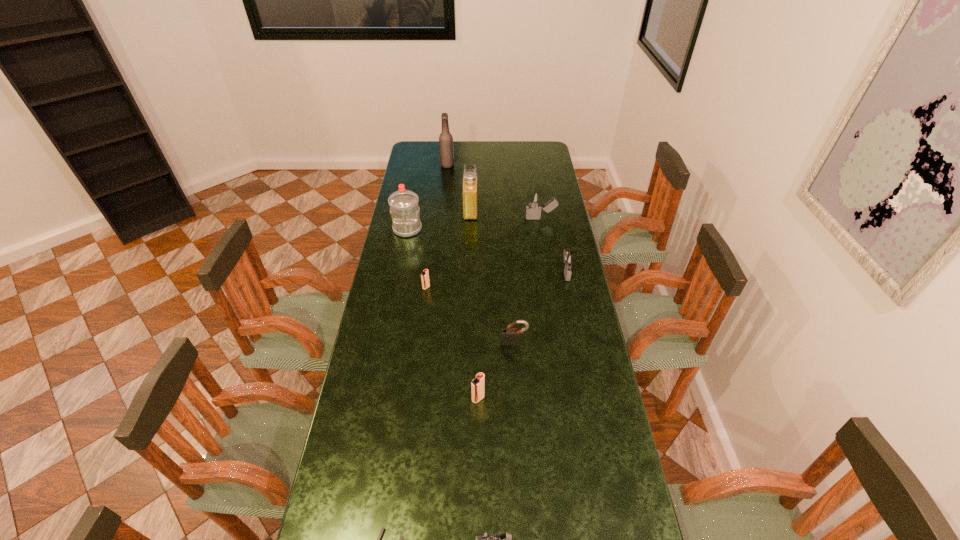
Find the location of a particular element. the fourth nearest object is located at coordinates (510, 336).

Image resolution: width=960 pixels, height=540 pixels. Identify the location of the leftmost igniter. (425, 275).

The width and height of the screenshot is (960, 540). Find the location of `the smaller red igniter`. the smaller red igniter is located at coordinates (425, 275).

Locate an element on the screen. free location located 0.120m on the label of the tallest object is located at coordinates (476, 165).

You are a GUI agent. You are given a task and a screenshot of the screen. Output one action in this format:
    pyautogui.click(x=<x>, y=<y>)
    Task: Click on the vacant area situated 0.120m on the front-facing side of the perfume
    
    Given the screenshot: What is the action you would take?
    pyautogui.click(x=503, y=211)

This screenshot has width=960, height=540. In order to click on vacant area situated 0.220m on the handle side of the water bottle in this screenshot , I will do `click(399, 272)`.

At what (x,y) coordinates should I click in order to perform the action: click on vacant space located 0.290m on the left of the biggest gray igniter. Please return your answer as a coordinate pair (x, y). This screenshot has height=540, width=960. Looking at the image, I should click on (463, 219).

The height and width of the screenshot is (540, 960). In order to click on vacant area situated on the left of the fourth nearest igniter in this screenshot , I will do `click(529, 272)`.

This screenshot has width=960, height=540. What are the coordinates of `vacant area situated on the right of the fourth farthest igniter` in the screenshot? It's located at (552, 399).

Where is `vacant region located 0.230m with the keyhole on the front of the seventh farthest object`? The height and width of the screenshot is (540, 960). vacant region located 0.230m with the keyhole on the front of the seventh farthest object is located at coordinates (518, 406).